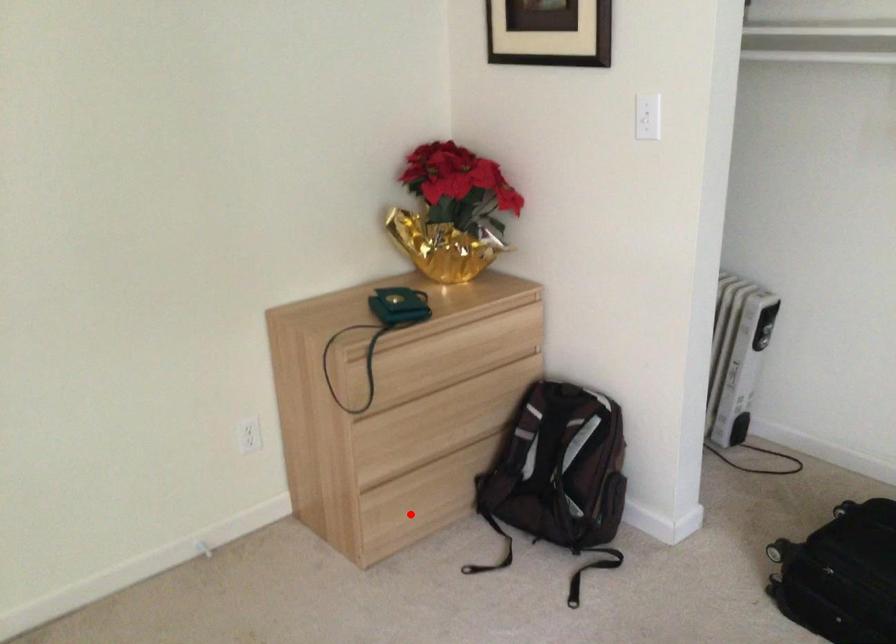
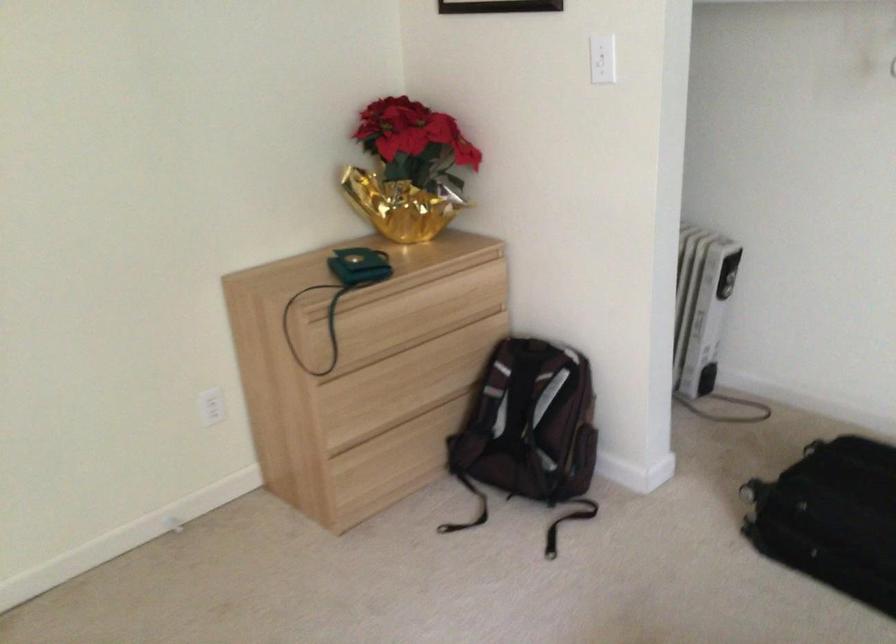
Locate, in the second image, the point that corresponds to the highlighted location in the first image.

(382, 478)